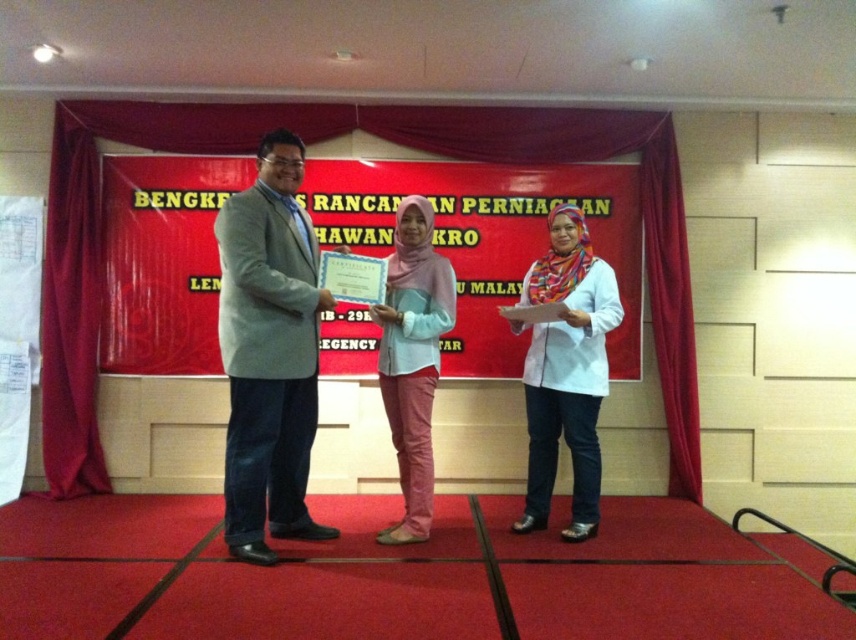
Question: Which object is the closest to the white paper at center?

Choices:
 (A) red velvet curtain at left
 (B) light gray suit at center
 (C) red velvet curtain at center

Answer: (C)

Question: Is white paper at center smaller than pink fabric hijab at center?

Choices:
 (A) yes
 (B) no

Answer: (A)

Question: Among these objects, which one is farthest from the camera?

Choices:
 (A) light gray suit at center
 (B) red velvet curtain at center

Answer: (B)

Question: Can you confirm if light gray suit at center is positioned above velvet red curtain at center?

Choices:
 (A) no
 (B) yes

Answer: (A)

Question: Which point is farther from the camera taking this photo?

Choices:
 (A) (158, 268)
 (B) (700, 474)

Answer: (B)

Question: Is red velvet curtain at left to the right of pink fabric hijab at center from the viewer's perspective?

Choices:
 (A) no
 (B) yes

Answer: (A)